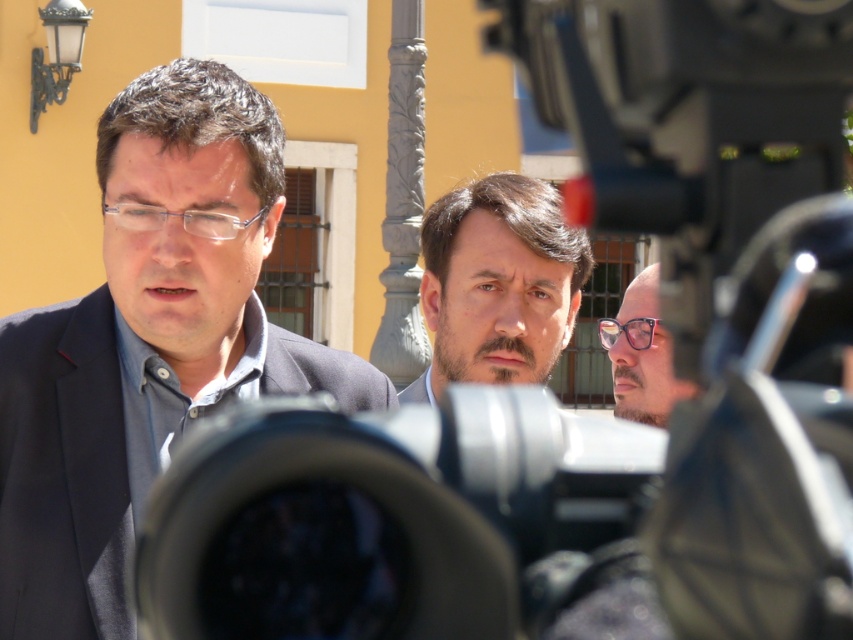
Question: Which point appears farthest from the camera in this image?

Choices:
 (A) (433, 340)
 (B) (636, 372)
 (C) (302, 564)
 (D) (91, 586)

Answer: (A)

Question: Does black plastic camera at center have a greater width compared to matte black suit at left?

Choices:
 (A) no
 (B) yes

Answer: (A)

Question: Which point appears farthest from the camera in this image?

Choices:
 (A) (235, 474)
 (B) (292, 355)
 (C) (614, 412)

Answer: (C)

Question: Which object is positioned farthest from the black plastic camera at center?

Choices:
 (A) pink glossy glasses at center
 (B) matte black suit at left
 (C) dark brown hair at center

Answer: (C)

Question: Does matte black suit at left appear on the left side of dark brown hair at center?

Choices:
 (A) yes
 (B) no

Answer: (A)

Question: Can you confirm if black plastic camera at center is positioned below pink glossy glasses at center?

Choices:
 (A) yes
 (B) no

Answer: (A)